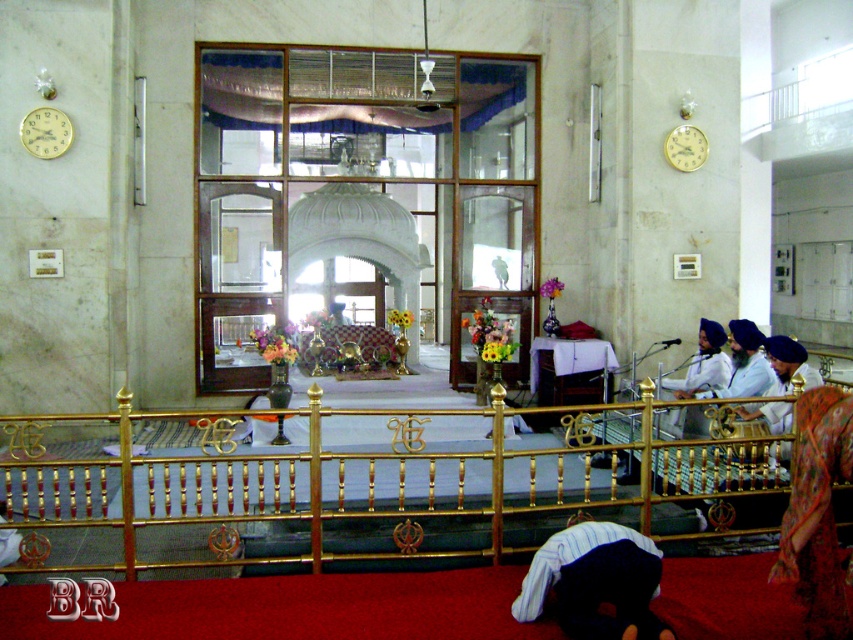
You are standing in the Gurdwara and want to place a small offering at the point marked by coordinates point (595,604). If your arm can reach up to 1.8 meters, can you reach the point without moving closer?

The point (595,604) is 4.07 meters away from the viewer. Since your arm can only reach up to 1.8 meters, you cannot reach the point without moving closer.

You are a visitor standing at the entrance of the Gurdwara. You see the gold polished rail at center and the dark blue turban at lower center. Which object is taller?

The gold polished rail at center is much taller than the dark blue turban at lower center.